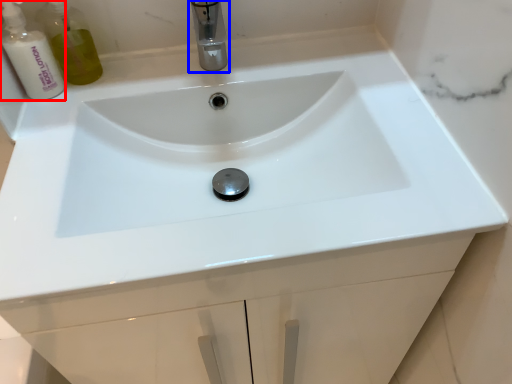
Question: Which of the following is the farthest to the observer, cleaning product (highlighted by a red box) or tap (highlighted by a blue box)?

Choices:
 (A) cleaning product
 (B) tap

Answer: (A)